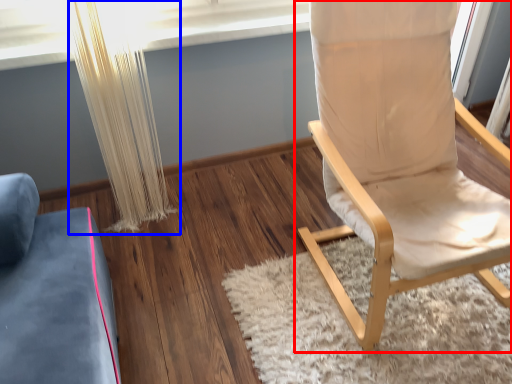
Question: Among these objects, which one is nearest to the camera, chair (highlighted by a red box) or curtain (highlighted by a blue box)?

Choices:
 (A) chair
 (B) curtain

Answer: (A)